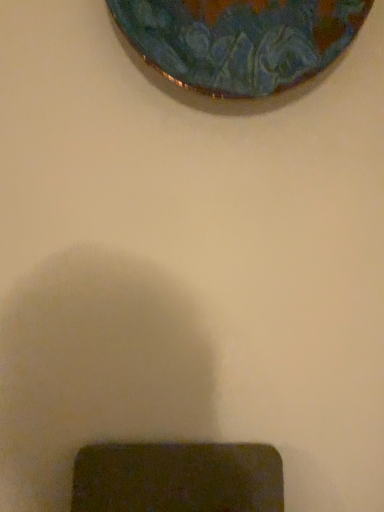
Locate an element on the screen. The image size is (384, 512). shiny ceramic plate at upper center is located at coordinates (239, 40).

The height and width of the screenshot is (512, 384). Describe the element at coordinates (239, 40) in the screenshot. I see `shiny ceramic plate at upper center` at that location.

Identify the location of shiny ceramic plate at upper center. The height and width of the screenshot is (512, 384). (239, 40).